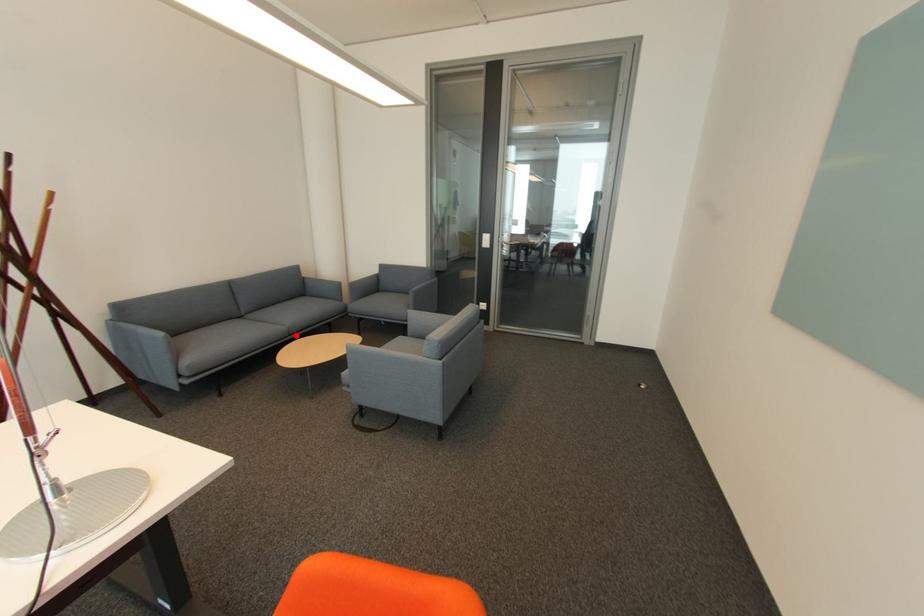
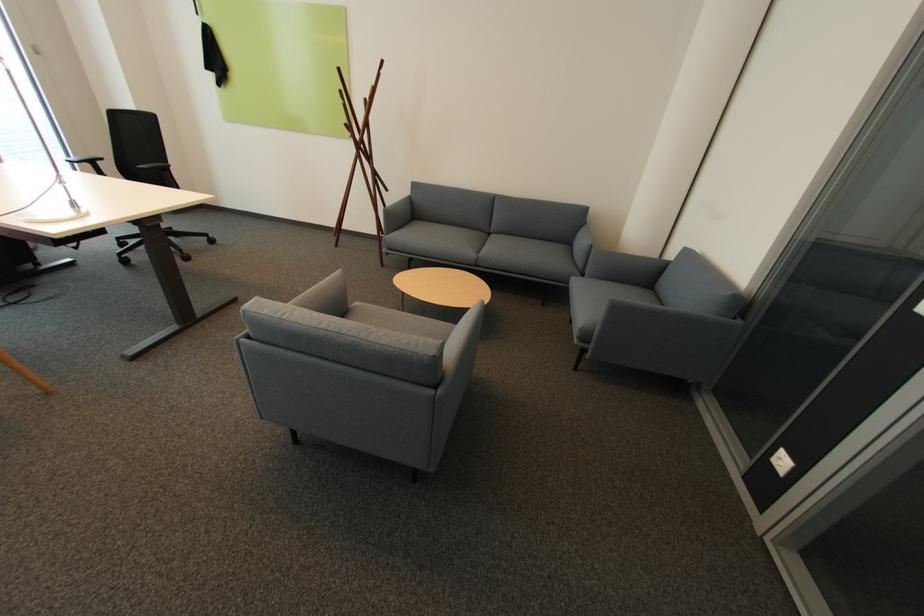
Question: I am providing you with two images of the same scene from different viewpoints. A red point is shown in image1. For the corresponding object point in image2, is it positioned nearer or farther from the camera?

Choices:
 (A) Nearer
 (B) Farther

Answer: (B)